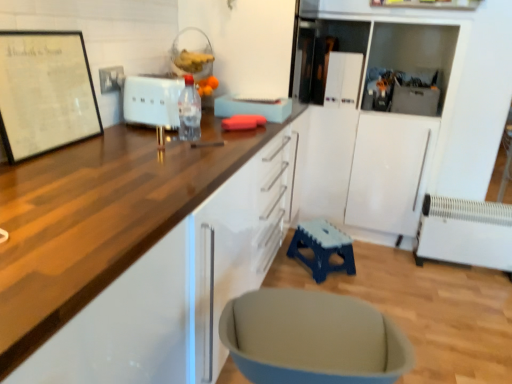
Find the location of `vacant region above blue plastic stool at lower center (from a real-world perspective)`. vacant region above blue plastic stool at lower center (from a real-world perspective) is located at coordinates (321, 236).